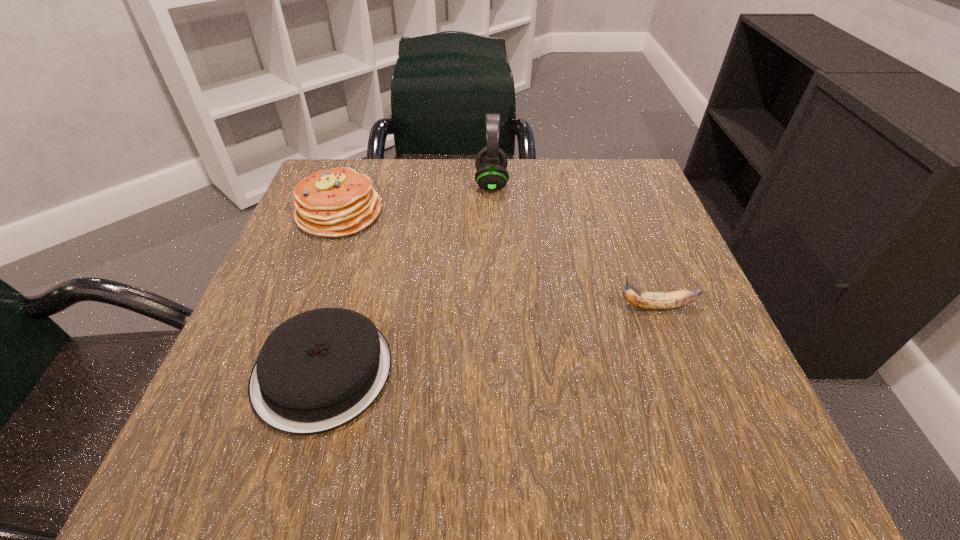
This screenshot has height=540, width=960. I want to click on free space located 0.270m on the ear cups of the tallest object, so click(357, 183).

Locate an element on the screen. The width and height of the screenshot is (960, 540). vacant area situated on the back of the taller pancake is located at coordinates (358, 164).

What are the coordinates of `vacant space located at the stem of the second nearest object` in the screenshot? It's located at (527, 307).

Where is `vacant area situated 0.160m at the stem of the second nearest object`? vacant area situated 0.160m at the stem of the second nearest object is located at coordinates (521, 307).

I want to click on free spot located at the stem of the second nearest object, so click(563, 307).

The height and width of the screenshot is (540, 960). I want to click on vacant area situated 0.120m on the right of the shortest object, so click(472, 372).

Identify the location of headset located in the far edge section of the desktop. The height and width of the screenshot is (540, 960). (491, 162).

Find the location of a particular element. Image resolution: width=960 pixels, height=540 pixels. pancake at the far edge is located at coordinates (338, 202).

I want to click on object at the near edge, so click(319, 370).

You are a GUI agent. You are given a task and a screenshot of the screen. Output one action in this format:
    pyautogui.click(x=<x>, y=<y>)
    Task: Click on the object at the right edge
    The height and width of the screenshot is (540, 960).
    Given the screenshot: What is the action you would take?
    pyautogui.click(x=645, y=300)